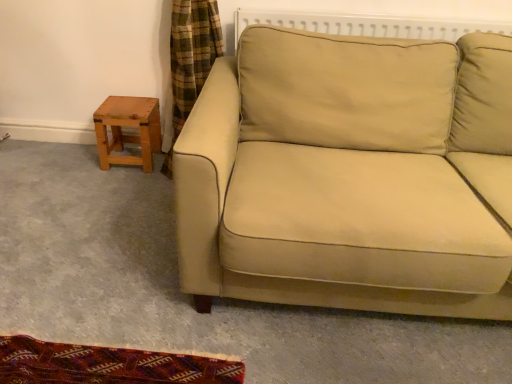
Where is `beige fabric couch at center`? The image size is (512, 384). beige fabric couch at center is located at coordinates (336, 181).

The width and height of the screenshot is (512, 384). Describe the element at coordinates (336, 181) in the screenshot. I see `beige fabric couch at center` at that location.

What do you see at coordinates (128, 126) in the screenshot?
I see `light brown wooden stool at left` at bounding box center [128, 126].

Identify the location of light brown wooden stool at left. The image size is (512, 384). point(128,126).

From the picture: What is the approximate width of light brown wooden stool at left?

It is 10.43 inches.

Locate an element on the screen. The width and height of the screenshot is (512, 384). beige fabric couch at center is located at coordinates (336, 181).

Considering the relative positions of light brown wooden stool at left and beige fabric couch at center in the image provided, is light brown wooden stool at left to the left of beige fabric couch at center from the viewer's perspective?

Indeed, light brown wooden stool at left is positioned on the left side of beige fabric couch at center.

Is light brown wooden stool at left positioned before beige fabric couch at center?

No.

Is point (106, 142) positioned behind point (248, 269)?

Yes.

Consider the image. From the image's perspective, between light brown wooden stool at left and beige fabric couch at center, who is located below?

beige fabric couch at center.

From a real-world perspective, which is physically above, light brown wooden stool at left or beige fabric couch at center?

In real-world perspective, beige fabric couch at center is above.

Considering the relative sizes of light brown wooden stool at left and beige fabric couch at center in the image provided, is light brown wooden stool at left thinner than beige fabric couch at center?

Indeed, light brown wooden stool at left has a lesser width compared to beige fabric couch at center.

Looking at this image, between light brown wooden stool at left and beige fabric couch at center, which one has less height?

light brown wooden stool at left.

Can you confirm if light brown wooden stool at left is bigger than beige fabric couch at center?

No, light brown wooden stool at left is not bigger than beige fabric couch at center.

Would you say beige fabric couch at center is part of light brown wooden stool at left's contents?

No, light brown wooden stool at left does not contain beige fabric couch at center.

Is light brown wooden stool at left placed right next to beige fabric couch at center?

No, light brown wooden stool at left is not with beige fabric couch at center.

Could you tell me if light brown wooden stool at left is turned towards beige fabric couch at center?

No, light brown wooden stool at left is not facing towards beige fabric couch at center.

Locate an element on the screen. This screenshot has width=512, height=384. studio couch in front of the light brown wooden stool at left is located at coordinates (336, 181).

Which is more to the right, beige fabric couch at center or light brown wooden stool at left?

beige fabric couch at center is more to the right.

Is the position of beige fabric couch at center less distant than that of light brown wooden stool at left?

Yes, beige fabric couch at center is closer to the viewer.

Does point (228, 240) come in front of point (151, 167)?

Yes, it is.

From the image's perspective, does beige fabric couch at center appear higher than light brown wooden stool at left?

Actually, beige fabric couch at center appears below light brown wooden stool at left in the image.

Looking at this image, from a real-world perspective, which is physically below, beige fabric couch at center or light brown wooden stool at left?

light brown wooden stool at left.

Between beige fabric couch at center and light brown wooden stool at left, which one has larger width?

beige fabric couch at center.

Considering the sizes of beige fabric couch at center and light brown wooden stool at left in the image, is beige fabric couch at center taller or shorter than light brown wooden stool at left?

beige fabric couch at center is taller than light brown wooden stool at left.

Does beige fabric couch at center have a smaller size compared to light brown wooden stool at left?

No.

Would you say beige fabric couch at center is inside or outside light brown wooden stool at left?

beige fabric couch at center is outside light brown wooden stool at left.

Are beige fabric couch at center and light brown wooden stool at left far apart?

Actually, beige fabric couch at center and light brown wooden stool at left are a little close together.

Is beige fabric couch at center oriented towards light brown wooden stool at left?

No, beige fabric couch at center is not aimed at light brown wooden stool at left.

Where is `studio couch on the right of the light brown wooden stool at left`? studio couch on the right of the light brown wooden stool at left is located at coordinates (336, 181).

You are a GUI agent. You are given a task and a screenshot of the screen. Output one action in this format:
    pyautogui.click(x=<x>, y=<y>)
    Task: Click on the studio couch on the right of light brown wooden stool at left
    The height and width of the screenshot is (384, 512).
    Given the screenshot: What is the action you would take?
    pyautogui.click(x=336, y=181)

This screenshot has width=512, height=384. Identify the location of studio couch in front of the light brown wooden stool at left. (336, 181).